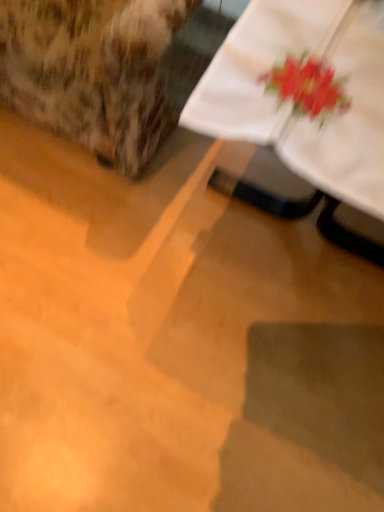
Question: Are floral fabric armchair at upper left and white cloth at upper right beside each other?

Choices:
 (A) no
 (B) yes

Answer: (A)

Question: Is floral fabric armchair at upper left not close to white cloth at upper right?

Choices:
 (A) no
 (B) yes

Answer: (A)

Question: From the image's perspective, is floral fabric armchair at upper left above white cloth at upper right?

Choices:
 (A) no
 (B) yes

Answer: (B)

Question: Is floral fabric armchair at upper left wider than white cloth at upper right?

Choices:
 (A) no
 (B) yes

Answer: (A)

Question: Is floral fabric armchair at upper left smaller than white cloth at upper right?

Choices:
 (A) no
 (B) yes

Answer: (A)

Question: Is floral fabric armchair at upper left taller than white cloth at upper right?

Choices:
 (A) no
 (B) yes

Answer: (B)

Question: From a real-world perspective, is white cloth at upper right over floral fabric armchair at upper left?

Choices:
 (A) no
 (B) yes

Answer: (A)

Question: Is white cloth at upper right further to camera compared to floral fabric armchair at upper left?

Choices:
 (A) no
 (B) yes

Answer: (A)

Question: Considering the relative sizes of white cloth at upper right and floral fabric armchair at upper left in the image provided, is white cloth at upper right smaller than floral fabric armchair at upper left?

Choices:
 (A) yes
 (B) no

Answer: (A)

Question: From the image's perspective, is white cloth at upper right below floral fabric armchair at upper left?

Choices:
 (A) no
 (B) yes

Answer: (B)

Question: Does white cloth at upper right have a lesser height compared to floral fabric armchair at upper left?

Choices:
 (A) no
 (B) yes

Answer: (B)

Question: Is white cloth at upper right oriented towards floral fabric armchair at upper left?

Choices:
 (A) yes
 (B) no

Answer: (B)

Question: Which is correct: white cloth at upper right is inside floral fabric armchair at upper left, or outside of it?

Choices:
 (A) inside
 (B) outside

Answer: (B)